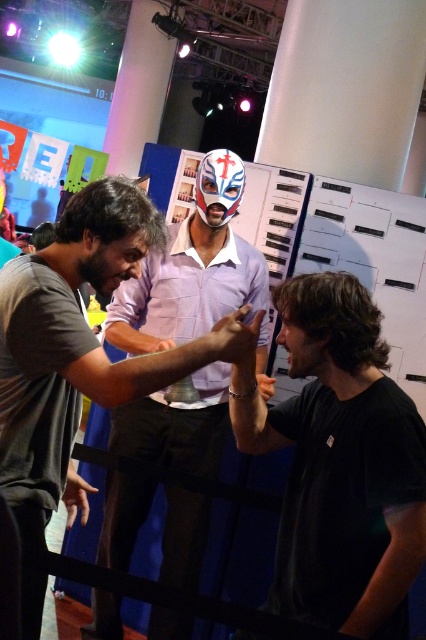
Question: From the image, what is the correct spatial relationship of black matte shirt at center in relation to white matte mask at center?

Choices:
 (A) right
 (B) left

Answer: (A)

Question: Which of the following is the closest to the observer?

Choices:
 (A) (157, 628)
 (B) (293, 557)

Answer: (B)

Question: Is black matte shirt at center to the right of white matte mask at center from the viewer's perspective?

Choices:
 (A) yes
 (B) no

Answer: (A)

Question: Is black matte shirt at center to the right of white matte mask at center from the viewer's perspective?

Choices:
 (A) yes
 (B) no

Answer: (A)